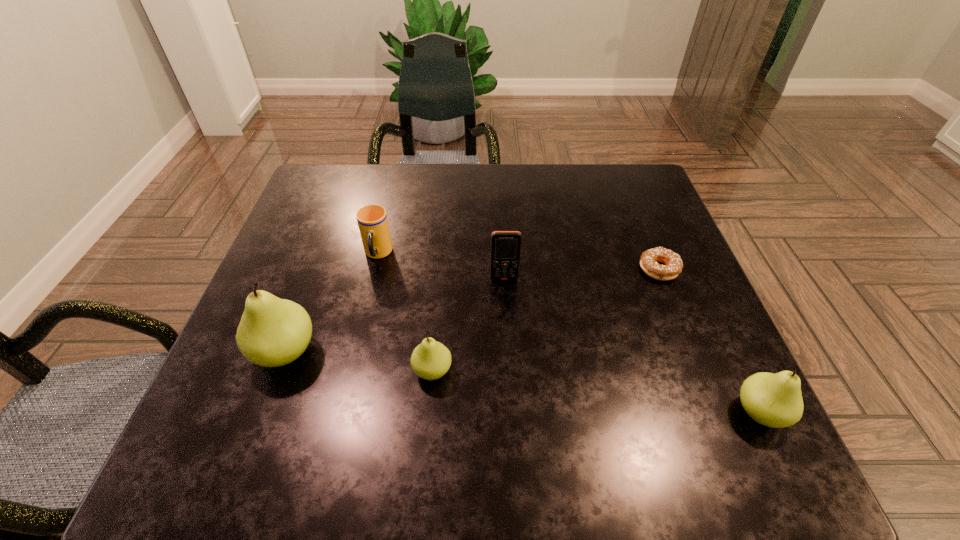
Please point a location where one more pear can be added evenly. Please provide its 2D coordinates. Your answer should be formatted as a tuple, i.e. [(x, y)], where the tuple contains the x and y coordinates of a point satisfying the conditions above.

[(590, 390)]